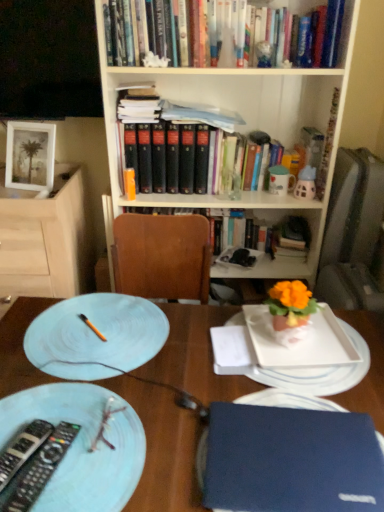
You are a GUI agent. You are given a task and a screenshot of the screen. Output one action in this format:
    pyautogui.click(x=<x>, y=<y>)
    Task: Click on the spots to the right of light blue ceramic plate at center-left, the first plate from the top
    This screenshot has width=384, height=512.
    Given the screenshot: What is the action you would take?
    pyautogui.click(x=225, y=351)